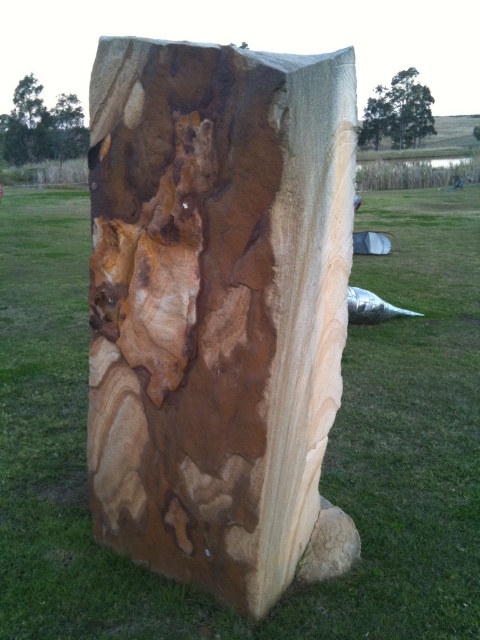
You are standing at the base of the large stone sculpture in the image. You want to place a small wooden bench somewhere on the grassy field. The bench must be placed exactly at the point labeled as point (216, 305). What object will the bench be placed on?

The bench will be placed on the natural wood slab at center located at point (216, 305).

Looking at this image, you are designing a garden path and need to know the relative widths of the natural wood slab at center and the green grass at center. Which one is wider?

The green grass at center is wider than the natural wood slab at center.

You are standing in front of the stone sculpture and want to place a small decorative rock between the green grass at center and the green leafy tree at upper center. Which object should you place it closer to if you want the rock to be more noticeable against the background?

You should place the small decorative rock closer to the green grass at center because it has a larger size compared to the green leafy tree at upper center, making it easier to notice against the background.